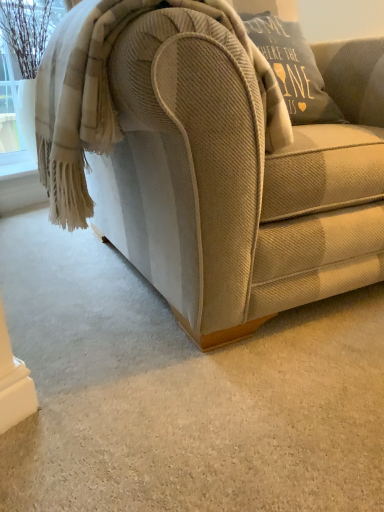
This screenshot has height=512, width=384. In order to click on beige woolen blanket at upper left in this screenshot , I will do `click(111, 95)`.

The image size is (384, 512). What do you see at coordinates (111, 95) in the screenshot?
I see `beige woolen blanket at upper left` at bounding box center [111, 95].

In order to click on beige corduroy couch at center in this screenshot , I will do `click(238, 178)`.

Measure the distance between beige corduroy couch at center and camera.

beige corduroy couch at center and camera are 64.11 centimeters apart.

What do you see at coordinates (238, 178) in the screenshot?
I see `beige corduroy couch at center` at bounding box center [238, 178].

From the picture: What is the approximate height of beige corduroy couch at center?

The height of beige corduroy couch at center is 33.26 inches.

The image size is (384, 512). Identify the location of beige woolen blanket at upper left. (111, 95).

Which object is positioned more to the right, beige woolen blanket at upper left or beige corduroy couch at center?

From the viewer's perspective, beige corduroy couch at center appears more on the right side.

Is the depth of beige woolen blanket at upper left less than that of beige corduroy couch at center?

No, it is behind beige corduroy couch at center.

Does point (42, 119) come behind point (291, 194)?

Yes, it is behind point (291, 194).

From the image's perspective, who appears lower, beige woolen blanket at upper left or beige corduroy couch at center?

beige woolen blanket at upper left.

From a real-world perspective, relative to beige corduroy couch at center, is beige woolen blanket at upper left vertically above or below?

In terms of real-world spatial position, beige woolen blanket at upper left is above beige corduroy couch at center.

Which of these two, beige woolen blanket at upper left or beige corduroy couch at center, is wider?

With larger width is beige corduroy couch at center.

Considering the sizes of objects beige woolen blanket at upper left and beige corduroy couch at center in the image provided, who is shorter, beige woolen blanket at upper left or beige corduroy couch at center?

beige woolen blanket at upper left is shorter.

Looking at the image, does beige woolen blanket at upper left seem bigger or smaller compared to beige corduroy couch at center?

Considering their sizes, beige woolen blanket at upper left takes up less space than beige corduroy couch at center.

Is beige corduroy couch at center completely or partially inside beige woolen blanket at upper left?

No, beige woolen blanket at upper left does not contain beige corduroy couch at center.

Would you say beige woolen blanket at upper left is a long distance from beige corduroy couch at center?

That's not correct — beige woolen blanket at upper left is a little close to beige corduroy couch at center.

Looking at this image, could you tell me if beige woolen blanket at upper left is turned towards beige corduroy couch at center?

Yes, beige woolen blanket at upper left is turned towards beige corduroy couch at center.

Can you tell me how much beige woolen blanket at upper left and beige corduroy couch at center differ in facing direction?

The angle between the facing direction of beige woolen blanket at upper left and the facing direction of beige corduroy couch at center is 6.75 degrees.

How distant is beige woolen blanket at upper left from beige corduroy couch at center?

They are 15.22 centimeters apart.

Locate an element on the screen. studio couch on the right of beige woolen blanket at upper left is located at coordinates (238, 178).

Can you confirm if beige corduroy couch at center is positioned to the right of beige woolen blanket at upper left?

Yes.

Which is in front, beige corduroy couch at center or beige woolen blanket at upper left?

beige corduroy couch at center.

Is point (173, 48) closer to viewer compared to point (92, 42)?

Yes.

From the image's perspective, would you say beige corduroy couch at center is shown under beige woolen blanket at upper left?

No, from the image's perspective, beige corduroy couch at center is not beneath beige woolen blanket at upper left.

From a real-world perspective, which object rests below the other?

beige corduroy couch at center.

Considering the sizes of beige corduroy couch at center and beige woolen blanket at upper left in the image, is beige corduroy couch at center wider or thinner than beige woolen blanket at upper left?

Considering their sizes, beige corduroy couch at center looks broader than beige woolen blanket at upper left.

Considering the sizes of beige corduroy couch at center and beige woolen blanket at upper left in the image, is beige corduroy couch at center taller or shorter than beige woolen blanket at upper left?

Considering their sizes, beige corduroy couch at center has more height than beige woolen blanket at upper left.

Who is smaller, beige corduroy couch at center or beige woolen blanket at upper left?

beige woolen blanket at upper left.

Is beige corduroy couch at center situated inside beige woolen blanket at upper left or outside?

beige corduroy couch at center is not inside beige woolen blanket at upper left, it's outside.

In the scene shown: Is beige corduroy couch at center next to beige woolen blanket at upper left?

beige corduroy couch at center is not next to beige woolen blanket at upper left, and they're not touching.

Is beige corduroy couch at center aimed at beige woolen blanket at upper left?

Yes, beige corduroy couch at center is oriented towards beige woolen blanket at upper left.

How different are the orientations of beige corduroy couch at center and beige woolen blanket at upper left in degrees?

They differ by 6.75 degrees in their facing directions.

I want to click on blanket on the left side of beige corduroy couch at center, so click(111, 95).

Where is `studio couch that appears in front of the beige woolen blanket at upper left`? This screenshot has height=512, width=384. studio couch that appears in front of the beige woolen blanket at upper left is located at coordinates (238, 178).

You are a GUI agent. You are given a task and a screenshot of the screen. Output one action in this format:
    pyautogui.click(x=<x>, y=<y>)
    Task: Click on the studio couch located above the beige woolen blanket at upper left (from the image's perspective)
    
    Given the screenshot: What is the action you would take?
    pyautogui.click(x=238, y=178)